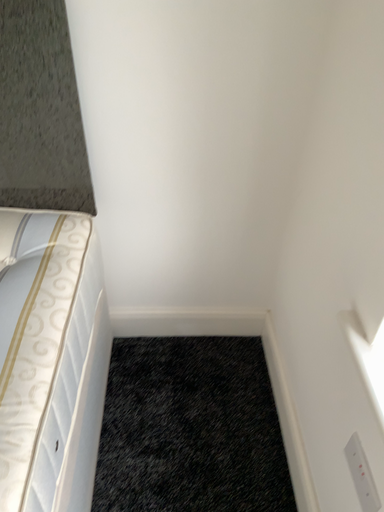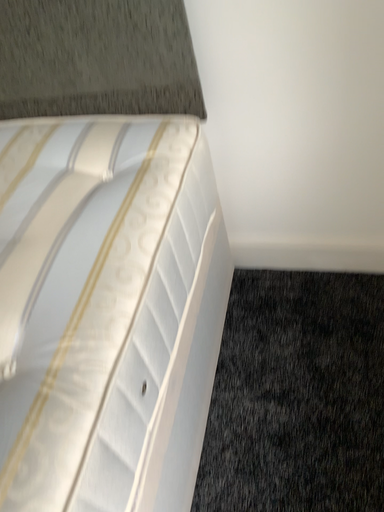
Question: How did the camera likely rotate when shooting the video?

Choices:
 (A) rotated left
 (B) rotated right

Answer: (A)